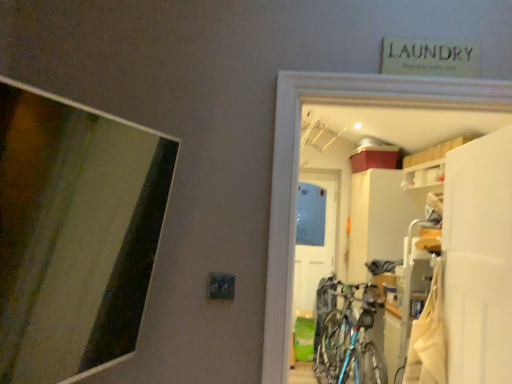
Question: Would you consider white matte door at center to be distant from white fabric laundry at lower right?

Choices:
 (A) yes
 (B) no

Answer: (A)

Question: Considering the relative sizes of white matte door at center and white fabric laundry at lower right in the image provided, is white matte door at center shorter than white fabric laundry at lower right?

Choices:
 (A) yes
 (B) no

Answer: (B)

Question: Is the depth of white matte door at center greater than that of white fabric laundry at lower right?

Choices:
 (A) no
 (B) yes

Answer: (B)

Question: Is white matte door at center in contact with white fabric laundry at lower right?

Choices:
 (A) yes
 (B) no

Answer: (B)

Question: Can you confirm if white matte door at center is bigger than white fabric laundry at lower right?

Choices:
 (A) no
 (B) yes

Answer: (B)

Question: Is white matte door at center looking in the opposite direction of white fabric laundry at lower right?

Choices:
 (A) yes
 (B) no

Answer: (B)

Question: Considering the relative sizes of white matte door at center and white matte screen door at right in the image provided, is white matte door at center bigger than white matte screen door at right?

Choices:
 (A) yes
 (B) no

Answer: (A)

Question: Considering the relative sizes of white matte door at center and white matte screen door at right in the image provided, is white matte door at center smaller than white matte screen door at right?

Choices:
 (A) no
 (B) yes

Answer: (A)

Question: Does white matte door at center lie behind white matte screen door at right?

Choices:
 (A) yes
 (B) no

Answer: (A)

Question: From the image's perspective, is white matte door at center above white matte screen door at right?

Choices:
 (A) no
 (B) yes

Answer: (A)

Question: Is the position of white matte door at center less distant than that of white matte screen door at right?

Choices:
 (A) yes
 (B) no

Answer: (B)

Question: Can you confirm if white matte door at center is wider than white matte screen door at right?

Choices:
 (A) no
 (B) yes

Answer: (A)

Question: Can you confirm if blue metallic bicycle at center is shorter than white matte screen door at right?

Choices:
 (A) no
 (B) yes

Answer: (B)